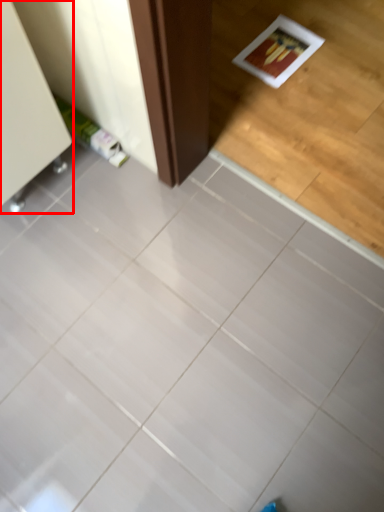
Question: Where is furniture (annotated by the red box) located in relation to ceramic tile in the image?

Choices:
 (A) right
 (B) left

Answer: (B)